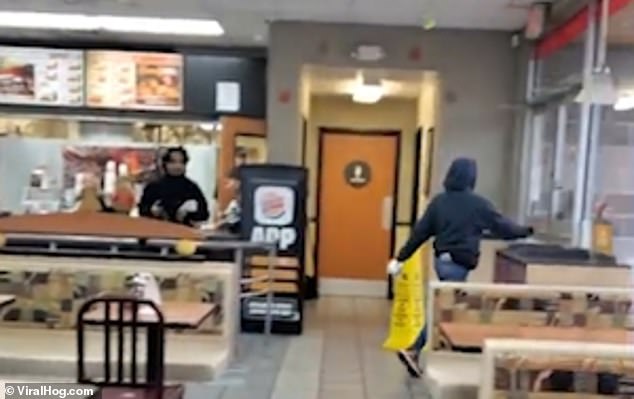
Identify the location of windows. This screenshot has height=399, width=634. (569, 174).